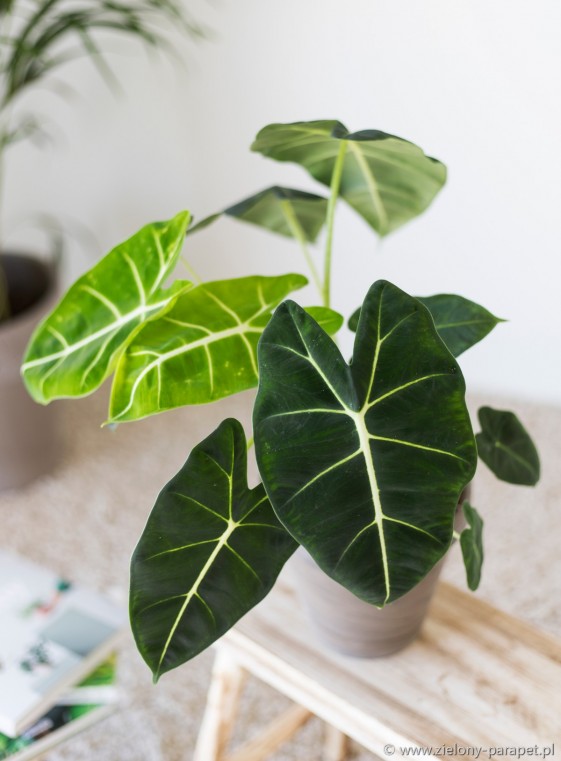
The height and width of the screenshot is (761, 561). I want to click on wood bench, so click(x=466, y=686).